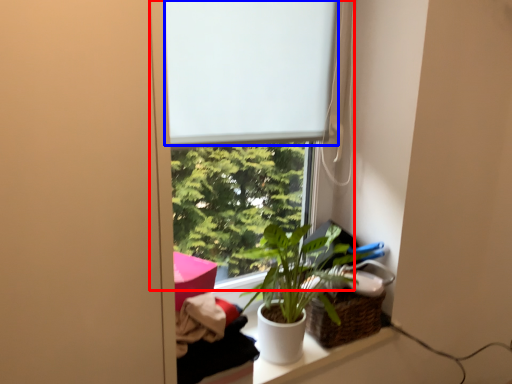
Question: Which of the following is the closest to the observer, window (highlighted by a red box) or window screen (highlighted by a blue box)?

Choices:
 (A) window
 (B) window screen

Answer: (A)